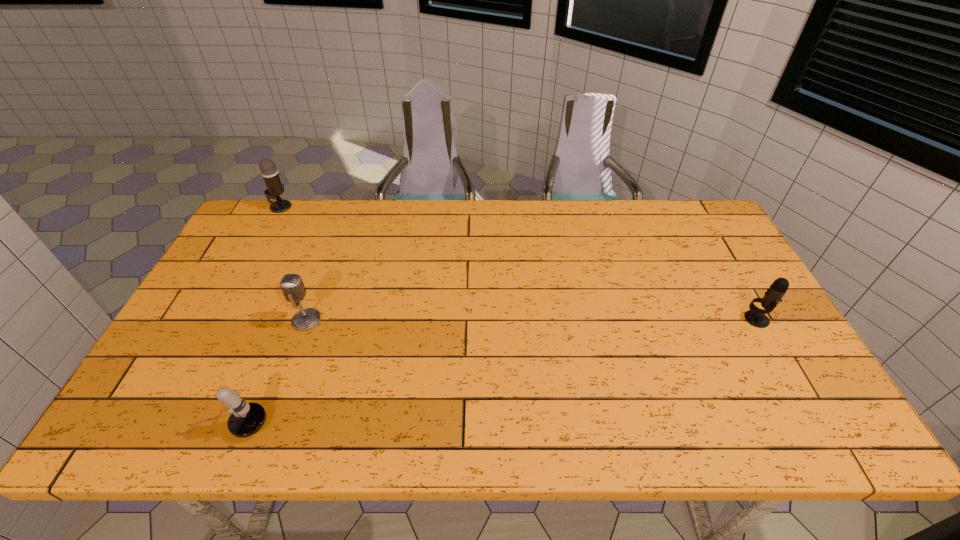
Locate an element on the screen. object located at the far left corner is located at coordinates (275, 187).

The image size is (960, 540). I want to click on object at the near left corner, so click(x=246, y=419).

At what (x,y) coordinates should I click in order to perform the action: click on vacant space at the far edge. Please return your answer as a coordinate pair (x, y). Image resolution: width=960 pixels, height=540 pixels. Looking at the image, I should click on (347, 207).

This screenshot has height=540, width=960. Find the location of `vacant space at the near edge of the desktop`. vacant space at the near edge of the desktop is located at coordinates (276, 417).

You are a GUI agent. You are given a task and a screenshot of the screen. Output one action in this format:
    pyautogui.click(x=<x>, y=<y>)
    Task: Click on the vacant space at the left edge of the desktop
    
    Given the screenshot: What is the action you would take?
    pyautogui.click(x=264, y=253)

Identify the location of blank space at the right edge of the desktop. The height and width of the screenshot is (540, 960). (759, 399).

Identify the location of vacant area at the far left corner of the desktop. (263, 237).

You are a GUI agent. You are given a task and a screenshot of the screen. Output one action in this format:
    pyautogui.click(x=<x>, y=<y>)
    Task: Click on the free point at the near right corner
    
    Given the screenshot: What is the action you would take?
    pyautogui.click(x=796, y=421)

Identify the location of vacant region between the nearest microphone and the farthest microphone. The width and height of the screenshot is (960, 540). (253, 316).

Identify the location of blank region between the nearest object and the rightmost microphone. The width and height of the screenshot is (960, 540). point(491,372).